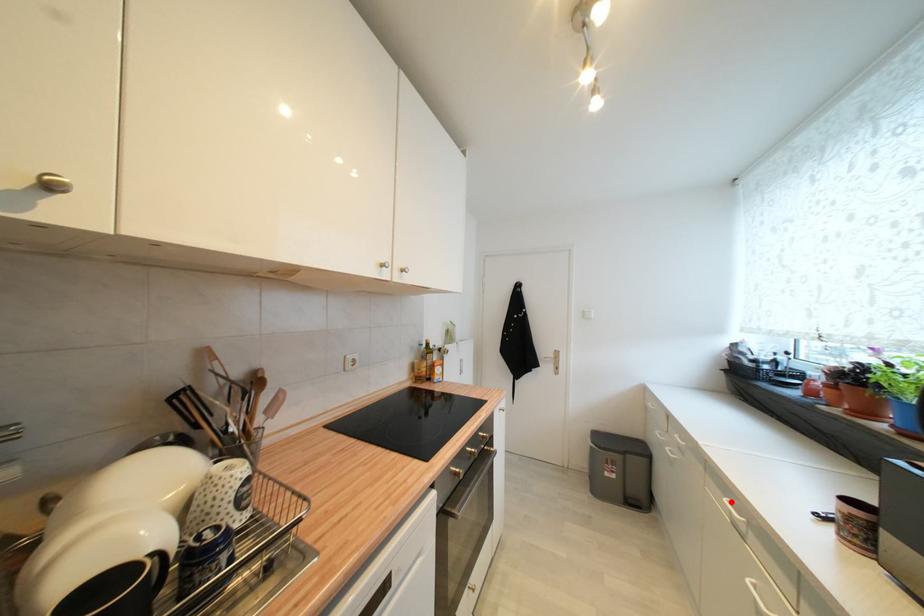
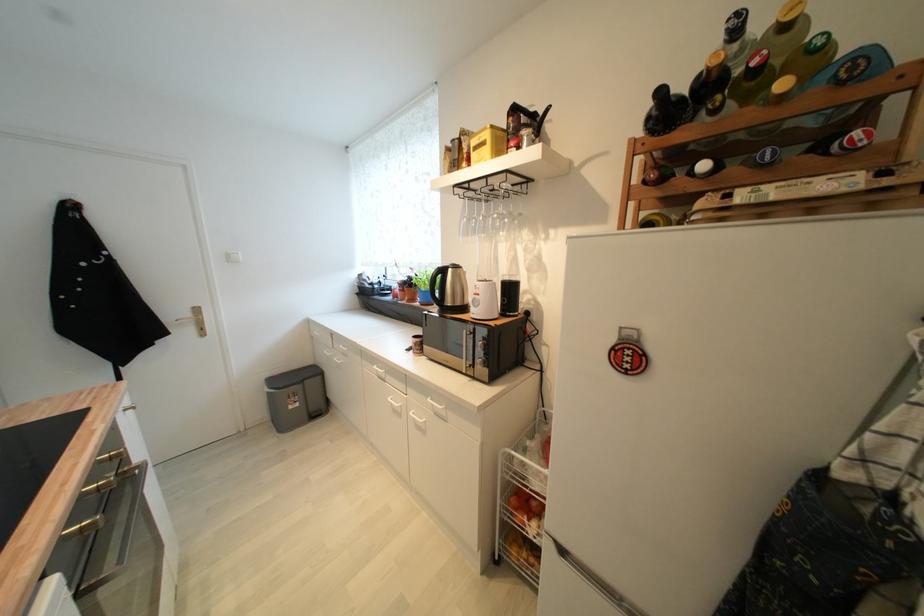
Question: I am providing you with two images of the same scene from different viewpoints. Given a red point in image1, look at the same physical point in image2. Is it:

Choices:
 (A) Closer to the viewpoint
 (B) Farther from the viewpoint

Answer: (B)